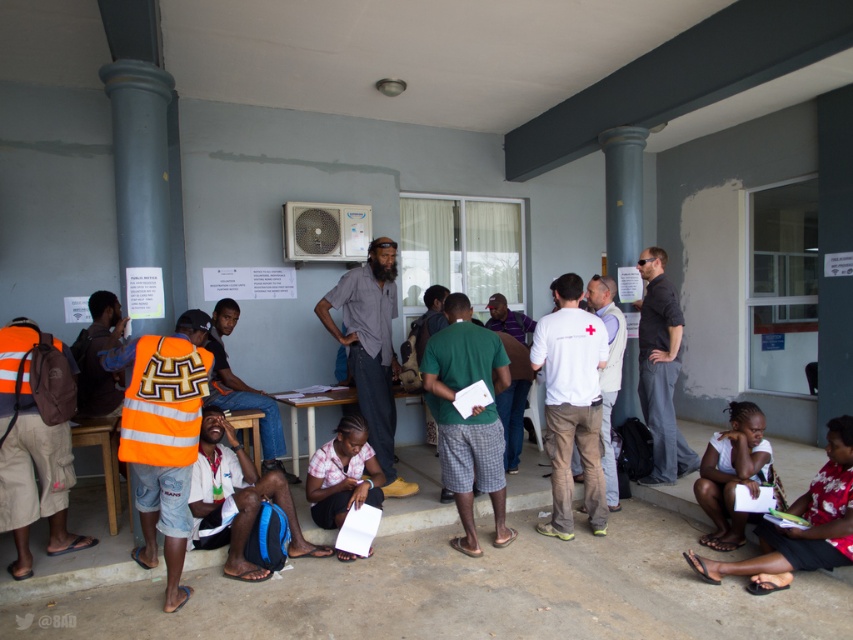
Question: Estimate the real-world distances between objects in this image. Which object is farther from the green plaid shorts at center?

Choices:
 (A) reflective orange vest at left
 (B) gray cotton shirt at center

Answer: (A)

Question: Observing the image, what is the correct spatial positioning of orange reflective vest at left in reference to white paper at lower right?

Choices:
 (A) above
 (B) below

Answer: (A)

Question: Which object is positioned closest to the white paper at lower right?

Choices:
 (A) green plaid shorts at center
 (B) white matte paper at lower right

Answer: (B)

Question: Which point is closer to the camera?

Choices:
 (A) white matte paper at lower right
 (B) dark gray pants at center
 (C) green plaid shorts at center

Answer: (A)

Question: Does white cotton shirt at center have a greater width compared to white paper at lower right?

Choices:
 (A) no
 (B) yes

Answer: (A)

Question: Can you confirm if white cotton shirt at center is positioned above gray cotton shirt at center?

Choices:
 (A) yes
 (B) no

Answer: (B)